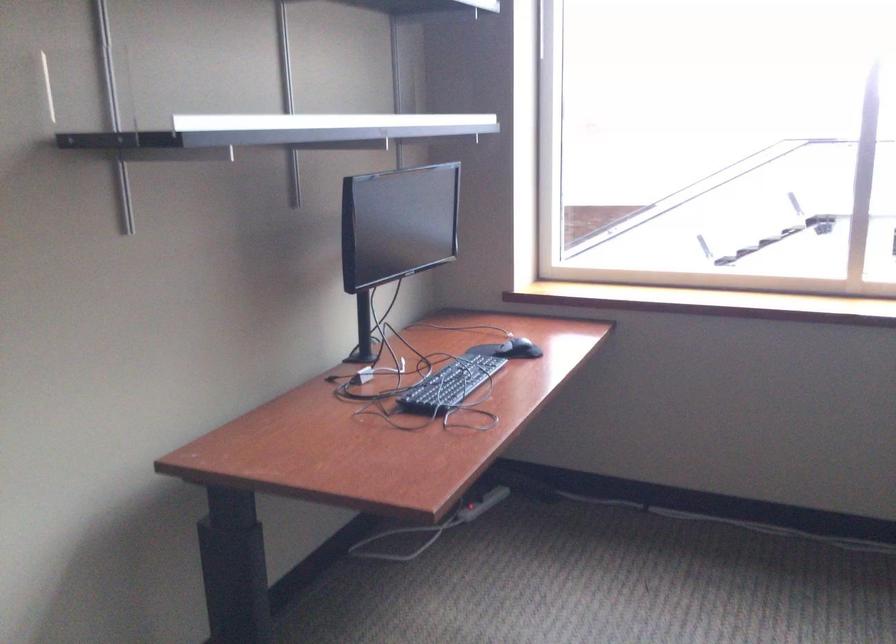
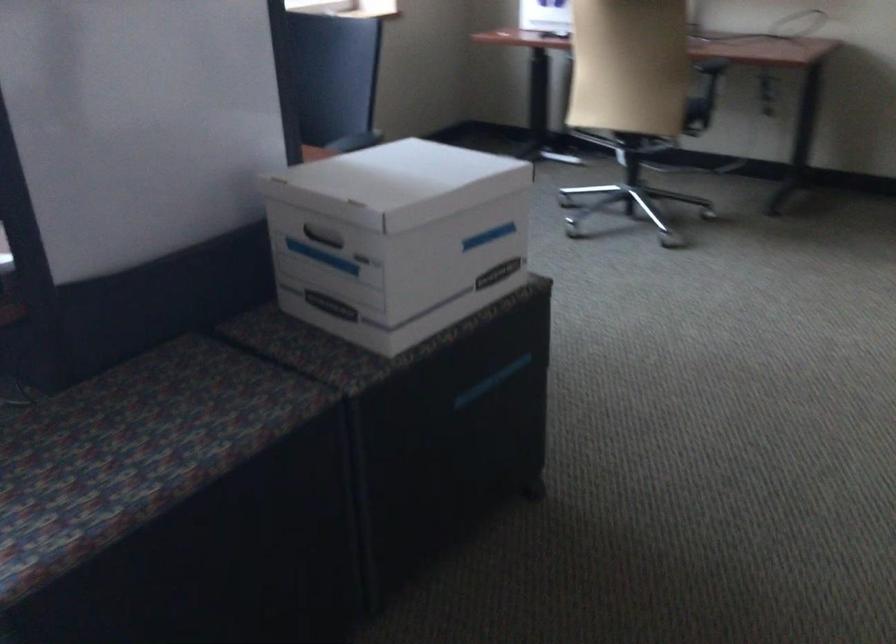
First-person continuous shooting, in which direction is the camera rotating?

The rotation direction of the camera is right-down.